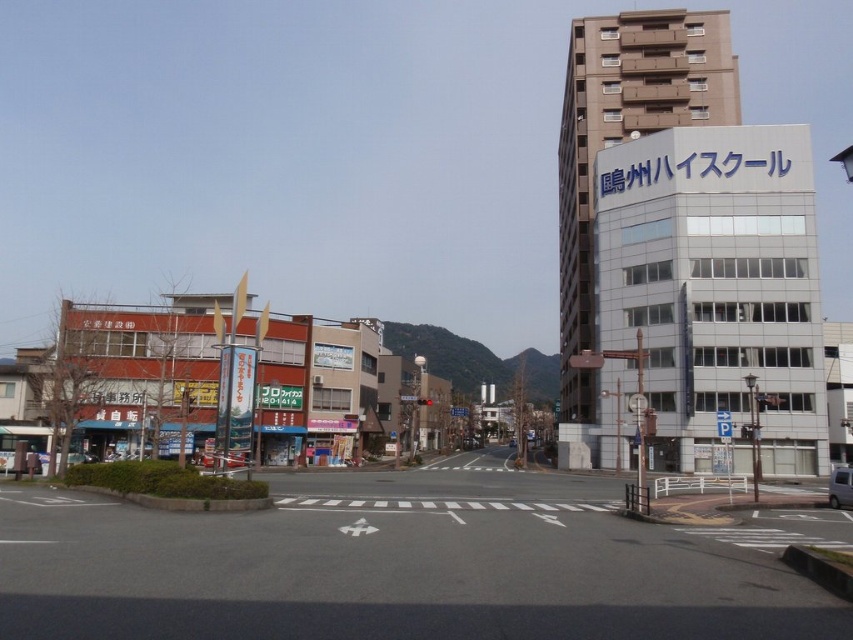
Does black asphalt road at center appear over metallic silver car at center?

Yes.

Which is more to the right, black asphalt road at center or metallic silver car at center?

From the viewer's perspective, black asphalt road at center appears more on the right side.

I want to click on black asphalt road at center, so click(405, 564).

Between black asphalt road at center and silver metallic van at lower right, which one has more height?

black asphalt road at center is taller.

Measure the distance between black asphalt road at center and camera.

black asphalt road at center is 6.89 meters away from camera.

What are the coordinates of `black asphalt road at center` in the screenshot? It's located at (405, 564).

Is silver metallic van at lower right above metallic silver car at center?

No, silver metallic van at lower right is not above metallic silver car at center.

Which is below, silver metallic van at lower right or metallic silver car at center?

silver metallic van at lower right is lower down.

Is point (834, 483) positioned after point (231, 461)?

Yes, it is.

You are a GUI agent. You are given a task and a screenshot of the screen. Output one action in this format:
    pyautogui.click(x=<x>, y=<y>)
    Task: Click on the silver metallic van at lower right
    
    Given the screenshot: What is the action you would take?
    pyautogui.click(x=840, y=486)